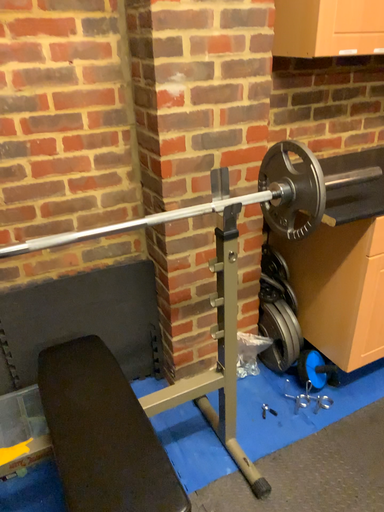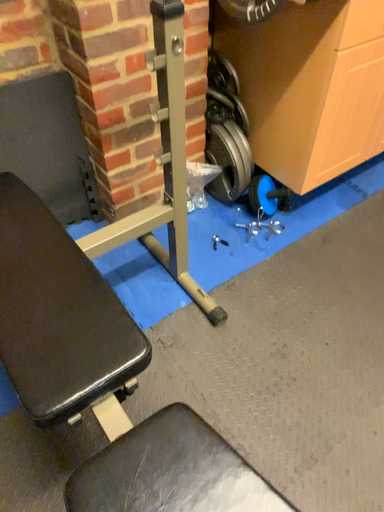
Question: Which way did the camera rotate in the video?

Choices:
 (A) rotated downward
 (B) rotated upward

Answer: (A)